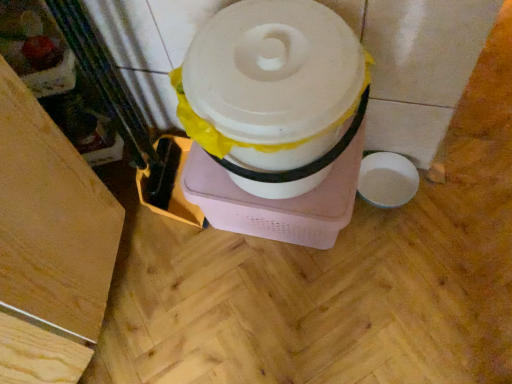
Locate an element on the screen. The width and height of the screenshot is (512, 384). wooden floor at lower left is located at coordinates (49, 245).

What do you see at coordinates (49, 245) in the screenshot? I see `wooden floor at lower left` at bounding box center [49, 245].

What do you see at coordinates (272, 91) in the screenshot?
I see `white matte toilet paper at center` at bounding box center [272, 91].

Locate an element on the screen. The image size is (512, 384). white matte toilet paper at center is located at coordinates (272, 91).

The width and height of the screenshot is (512, 384). I want to click on wooden floor at lower left, so click(x=49, y=245).

Is wooden floor at lower left at the right side of white matte toilet paper at center?

No.

Considering their positions, is wooden floor at lower left located in front of or behind white matte toilet paper at center?

wooden floor at lower left is in front of white matte toilet paper at center.

Does point (68, 340) come farther from viewer compared to point (294, 166)?

Yes, it is behind point (294, 166).

From the image's perspective, is wooden floor at lower left located above or below white matte toilet paper at center?

Based on their image positions, wooden floor at lower left is located beneath white matte toilet paper at center.

In the scene shown: From a real-world perspective, who is located lower, wooden floor at lower left or white matte toilet paper at center?

wooden floor at lower left, from a real-world perspective.

Which object is wider, wooden floor at lower left or white matte toilet paper at center?

wooden floor at lower left.

Is wooden floor at lower left shorter than white matte toilet paper at center?

No, wooden floor at lower left is not shorter than white matte toilet paper at center.

Considering the sizes of objects wooden floor at lower left and white matte toilet paper at center in the image provided, who is smaller, wooden floor at lower left or white matte toilet paper at center?

white matte toilet paper at center.

Can white matte toilet paper at center be found inside wooden floor at lower left?

No, white matte toilet paper at center is not a part of wooden floor at lower left.

Is there a large distance between wooden floor at lower left and white matte toilet paper at center?

Actually, wooden floor at lower left and white matte toilet paper at center are a little close together.

Is wooden floor at lower left oriented towards white matte toilet paper at center?

Yes.

This screenshot has width=512, height=384. There is a wooden floor at lower left. Find the location of `toilet paper above it (from a real-world perspective)`. toilet paper above it (from a real-world perspective) is located at coordinates (272, 91).

Consider the image. Considering the positions of objects white matte toilet paper at center and wooden floor at lower left in the image provided, who is more to the left, white matte toilet paper at center or wooden floor at lower left?

wooden floor at lower left is more to the left.

Consider the image. In the image, is white matte toilet paper at center positioned in front of or behind wooden floor at lower left?

In the image, white matte toilet paper at center appears behind wooden floor at lower left.

Which is in front, point (295, 90) or point (80, 234)?

The point (295, 90) is closer.

From the image's perspective, is white matte toilet paper at center located above wooden floor at lower left?

Yes.

From a real-world perspective, is white matte toilet paper at center physically above wooden floor at lower left?

Yes, from a real-world perspective, white matte toilet paper at center is over wooden floor at lower left

Which of these two, white matte toilet paper at center or wooden floor at lower left, is thinner?

white matte toilet paper at center is thinner.

Which of these two, white matte toilet paper at center or wooden floor at lower left, stands shorter?

white matte toilet paper at center is shorter.

Considering the sizes of objects white matte toilet paper at center and wooden floor at lower left in the image provided, who is smaller, white matte toilet paper at center or wooden floor at lower left?

white matte toilet paper at center is smaller.

Is white matte toilet paper at center located outside wooden floor at lower left?

Yes.

Is white matte toilet paper at center placed right next to wooden floor at lower left?

white matte toilet paper at center and wooden floor at lower left are not in contact.

Is white matte toilet paper at center looking in the opposite direction of wooden floor at lower left?

No, white matte toilet paper at center is not facing the opposite direction of wooden floor at lower left.

How many degrees apart are the facing directions of white matte toilet paper at center and wooden floor at lower left?

white matte toilet paper at center and wooden floor at lower left are facing 90.5 degrees away from each other.

Identify the location of wood on the left of white matte toilet paper at center. (49, 245).

This screenshot has width=512, height=384. In order to click on wood located in front of the white matte toilet paper at center in this screenshot , I will do `click(49, 245)`.

The width and height of the screenshot is (512, 384). In the image, there is a white matte toilet paper at center. Identify the location of wood below it (from a real-world perspective). (49, 245).